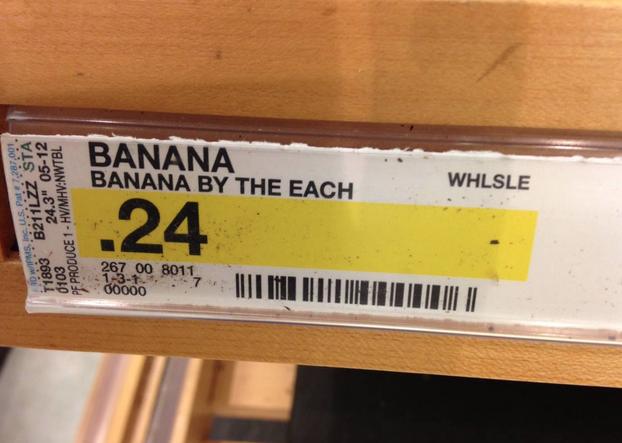
You are a GUI agent. You are given a task and a screenshot of the screen. Output one action in this format:
    pyautogui.click(x=<x>, y=<y>)
    Task: Click on the shelf
    
    Given the screenshot: What is the action you would take?
    pyautogui.click(x=476, y=88)